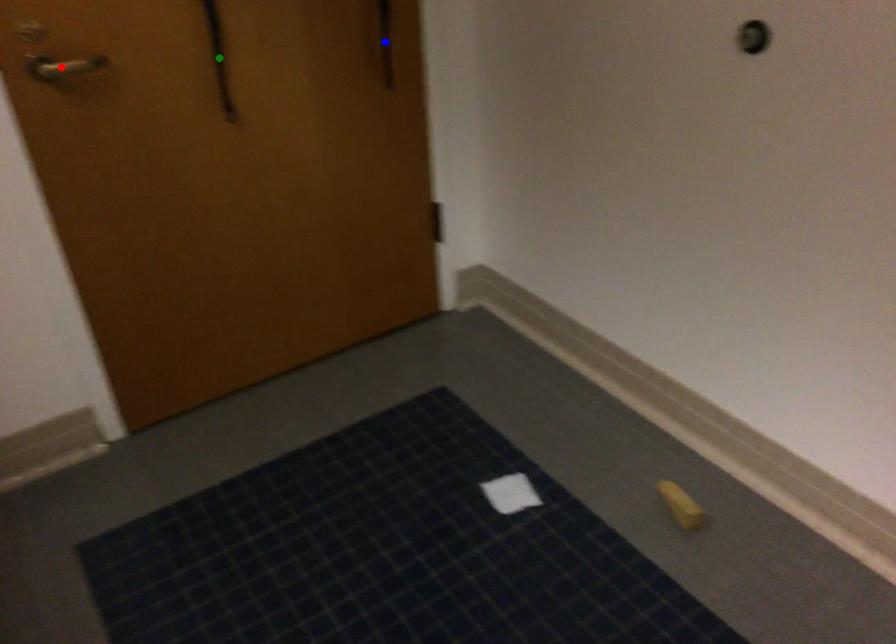
Order these from farthest to nearest:
1. blue point
2. green point
3. red point

blue point < green point < red point